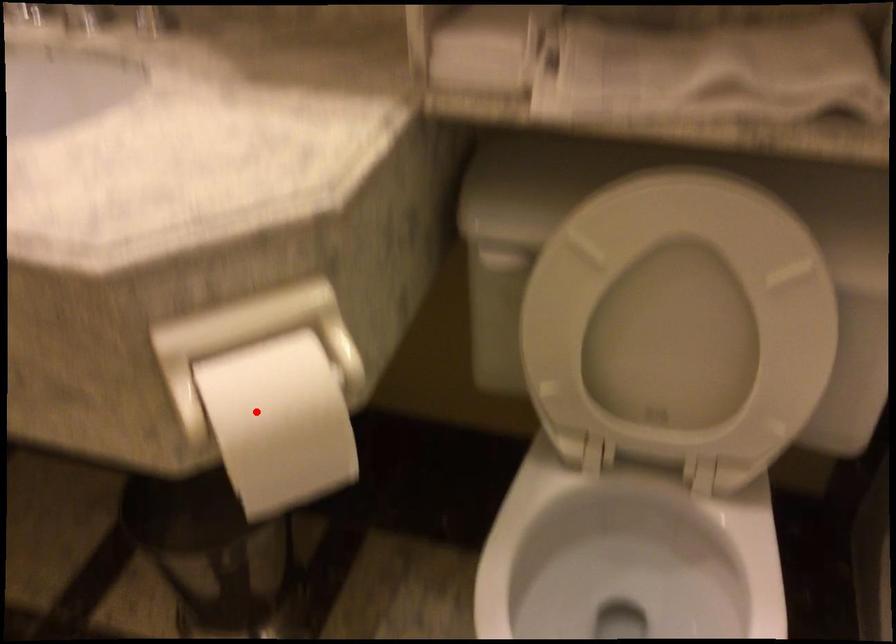
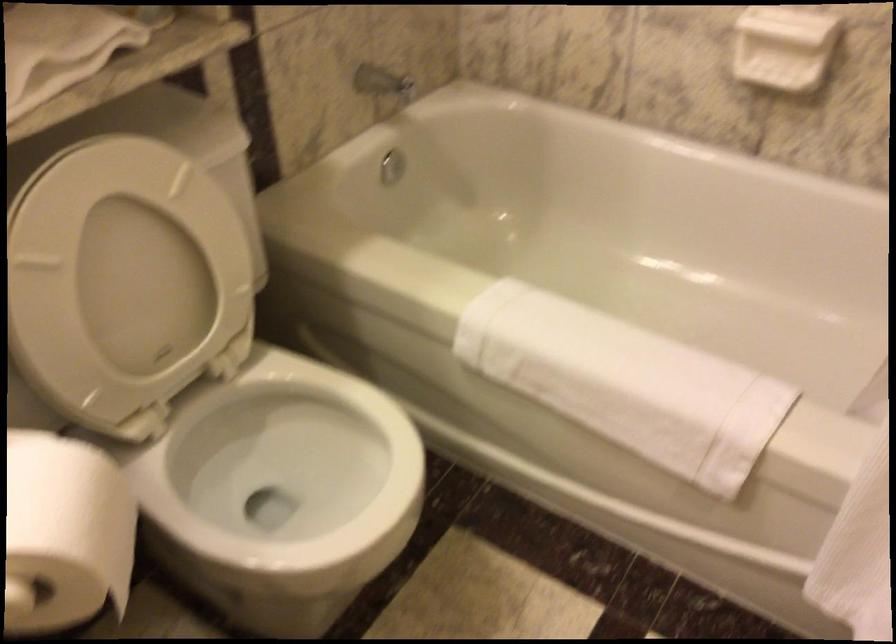
Find the pixel in the second image that matches the highlighted location in the first image.

(64, 534)